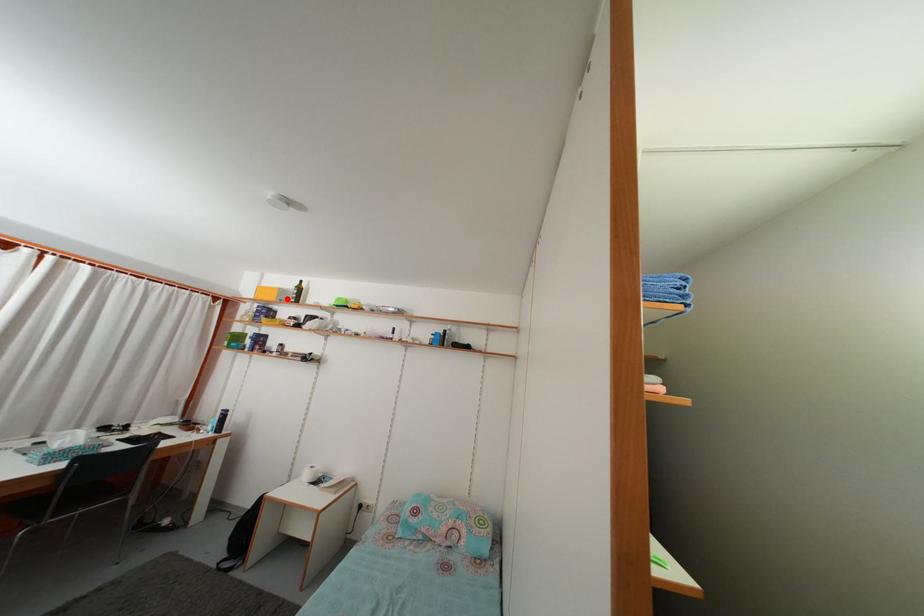
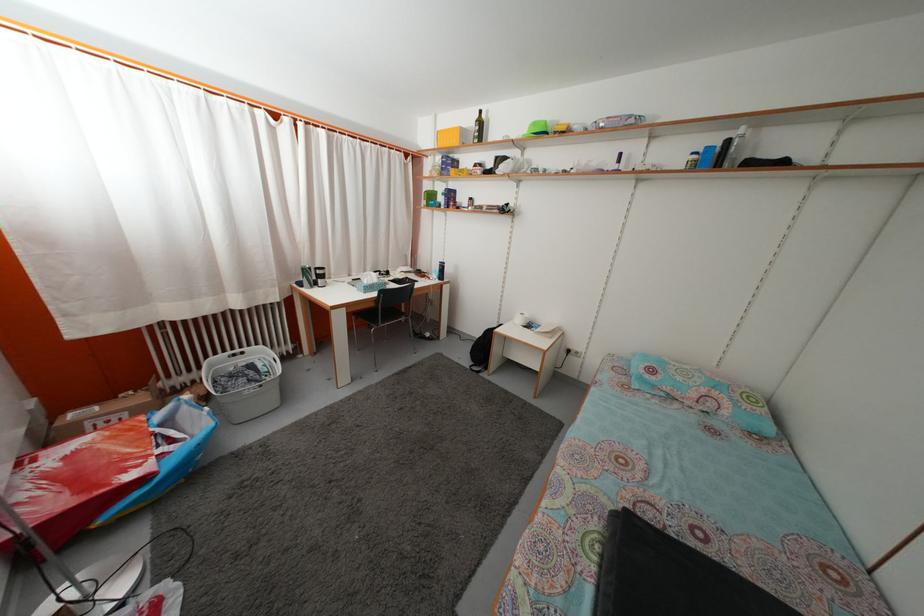
The point at the highlighted location is marked in the first image. Where is the corresponding point in the second image?

(468, 139)